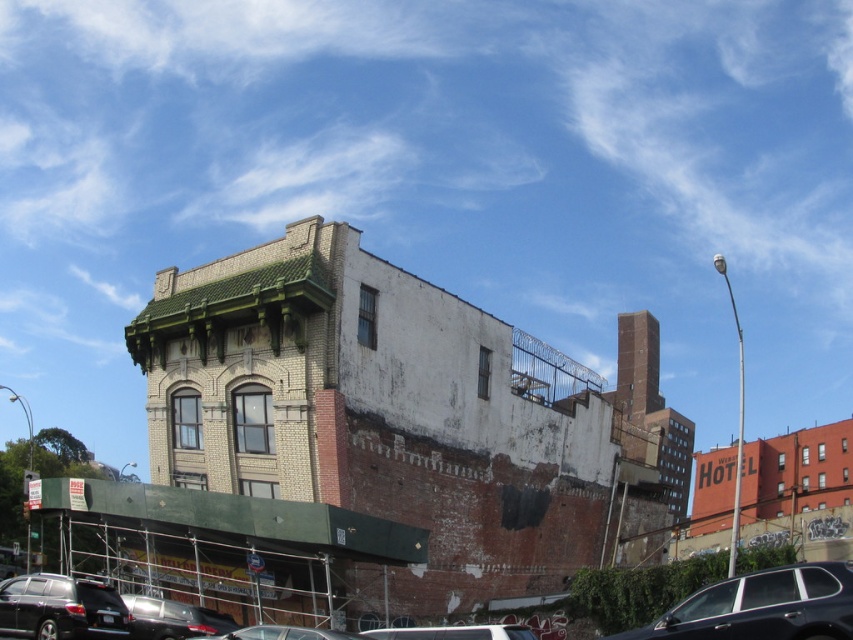
Who is more forward, (711, 605) or (248, 637)?

Point (711, 605) is in front.

Between shiny black sedan at lower right and metallic silver car at lower center, which one has more height?

Standing taller between the two is shiny black sedan at lower right.

Is point (802, 612) positioned before point (364, 637)?

Yes, it is.

Where is `shiny black sedan at lower right`? This screenshot has width=853, height=640. shiny black sedan at lower right is located at coordinates (762, 605).

Does shiny black sedan at lower right lie behind white matte car at lower center?

No, it is not.

Who is positioned more to the right, shiny black sedan at lower right or white matte car at lower center?

shiny black sedan at lower right is more to the right.

Locate an element on the screen. shiny black sedan at lower right is located at coordinates (762, 605).

Can you confirm if shiny black suv at lower left is positioned below white matte car at lower center?

Actually, shiny black suv at lower left is above white matte car at lower center.

Does shiny black suv at lower left have a lesser height compared to white matte car at lower center?

Indeed, shiny black suv at lower left has a lesser height compared to white matte car at lower center.

Is point (80, 588) farther from camera compared to point (485, 632)?

That is True.

The height and width of the screenshot is (640, 853). What are the coordinates of `shiny black suv at lower left` in the screenshot? It's located at (61, 609).